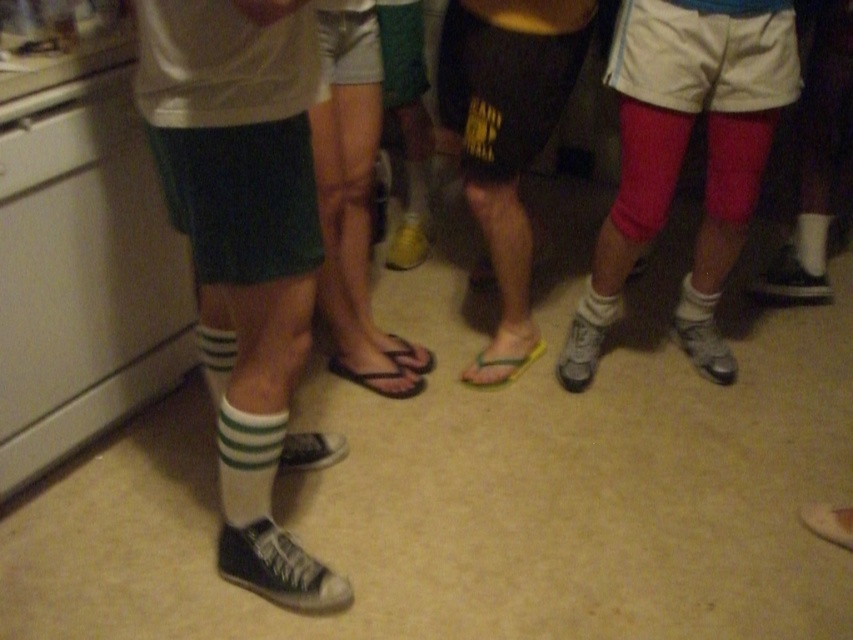
Question: Among these points, which one is farthest from the camera?

Choices:
 (A) (485, 173)
 (B) (273, 368)

Answer: (A)

Question: Does matte black sneaker at left have a lesser width compared to rubber flip-flop at center?

Choices:
 (A) yes
 (B) no

Answer: (B)

Question: Is matte black sneaker at left further to camera compared to rubber flip-flop at center?

Choices:
 (A) no
 (B) yes

Answer: (A)

Question: Which point is farther to the camera?

Choices:
 (A) (311, 454)
 (B) (527, 10)

Answer: (A)

Question: Is matte black sneaker at left smaller than rubber flip-flop at center?

Choices:
 (A) yes
 (B) no

Answer: (B)